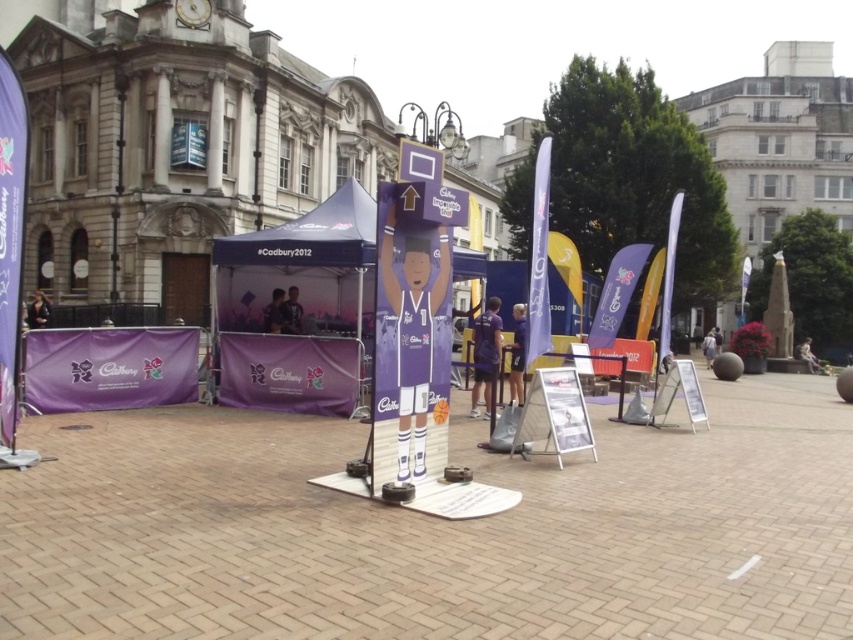
Question: Observing the image, what is the correct spatial positioning of purple fabric tent at center in reference to purple fabric canopy at left?

Choices:
 (A) right
 (B) left

Answer: (A)

Question: Among these objects, which one is nearest to the camera?

Choices:
 (A) purple fabric canopy at left
 (B) purple fabric tent at center

Answer: (A)

Question: From the image, what is the correct spatial relationship of purple fabric tent at center in relation to purple fabric canopy at left?

Choices:
 (A) above
 (B) below

Answer: (B)

Question: Which point is closer to the camera?

Choices:
 (A) purple fabric canopy at left
 (B) purple fabric tent at center

Answer: (A)

Question: Does purple fabric tent at center have a lesser width compared to purple fabric canopy at left?

Choices:
 (A) yes
 (B) no

Answer: (B)